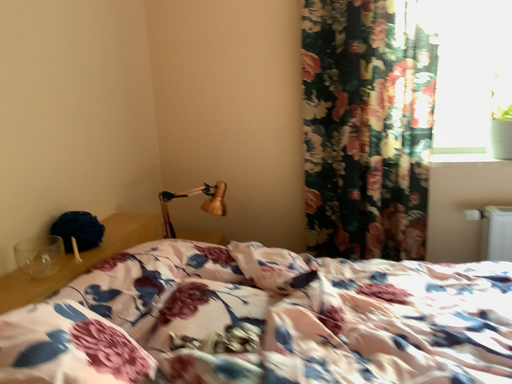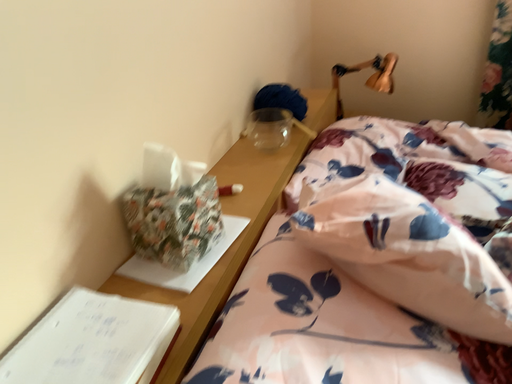
Question: How did the camera likely rotate when shooting the video?

Choices:
 (A) rotated downward
 (B) rotated upward

Answer: (A)